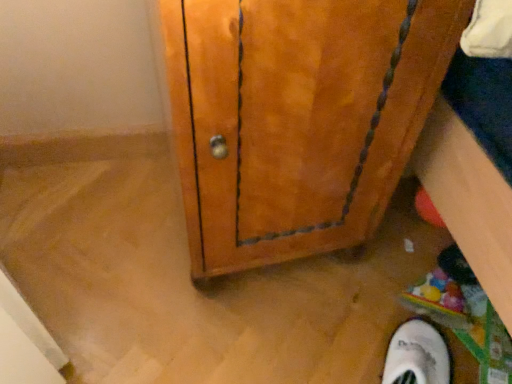
Question: From the image's perspective, is wooden cabinet at center on top of white suede shoe at lower right?

Choices:
 (A) no
 (B) yes

Answer: (B)

Question: Is wooden cabinet at center turned away from white suede shoe at lower right?

Choices:
 (A) no
 (B) yes

Answer: (A)

Question: From a real-world perspective, is wooden cabinet at center positioned under white suede shoe at lower right based on gravity?

Choices:
 (A) no
 (B) yes

Answer: (A)

Question: Can you confirm if wooden cabinet at center is bigger than white suede shoe at lower right?

Choices:
 (A) yes
 (B) no

Answer: (A)

Question: Is wooden cabinet at center thinner than white suede shoe at lower right?

Choices:
 (A) yes
 (B) no

Answer: (B)

Question: Considering the relative sizes of wooden cabinet at center and white suede shoe at lower right in the image provided, is wooden cabinet at center wider than white suede shoe at lower right?

Choices:
 (A) no
 (B) yes

Answer: (B)

Question: Does white suede shoe at lower right have a lesser width compared to wooden cabinet at center?

Choices:
 (A) yes
 (B) no

Answer: (A)

Question: Does white suede shoe at lower right have a greater height compared to wooden cabinet at center?

Choices:
 (A) no
 (B) yes

Answer: (A)

Question: From the image's perspective, is white suede shoe at lower right on wooden cabinet at center?

Choices:
 (A) yes
 (B) no

Answer: (B)

Question: From the image's perspective, does white suede shoe at lower right appear lower than wooden cabinet at center?

Choices:
 (A) yes
 (B) no

Answer: (A)

Question: Is white suede shoe at lower right closer to the viewer compared to wooden cabinet at center?

Choices:
 (A) no
 (B) yes

Answer: (A)

Question: Is there a large distance between white suede shoe at lower right and wooden cabinet at center?

Choices:
 (A) no
 (B) yes

Answer: (A)

Question: Considering the positions of white suede shoe at lower right and wooden cabinet at center in the image, is white suede shoe at lower right wider or thinner than wooden cabinet at center?

Choices:
 (A) thin
 (B) wide

Answer: (A)